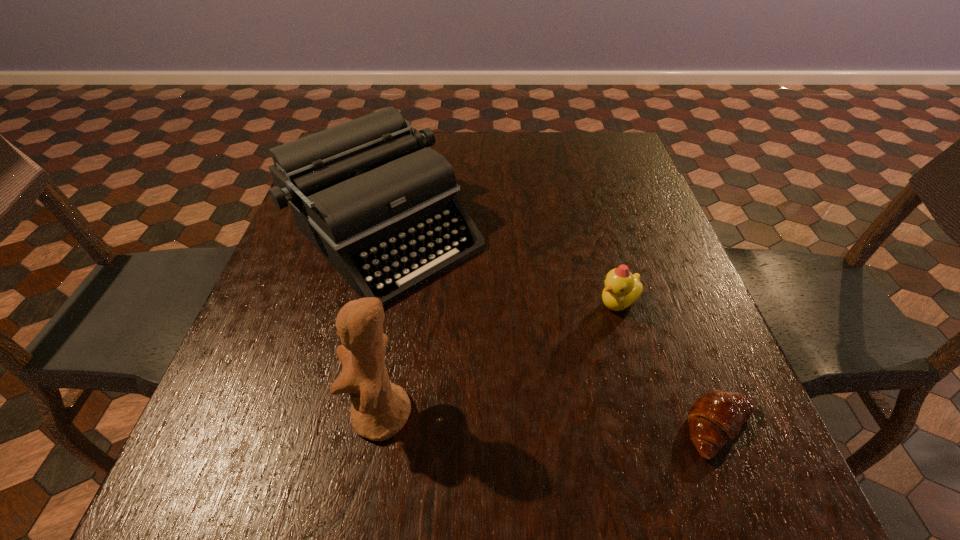
Locate an element on the screen. This screenshot has height=540, width=960. vacant space on the desktop that is between the tallest object and the crescent roll and is positioned on the front-facing side of the duckling is located at coordinates (546, 422).

Image resolution: width=960 pixels, height=540 pixels. Identify the location of vacant space on the desktop that is between the figurine and the shortest object and is positioned on the typing side of the typewriter. (597, 424).